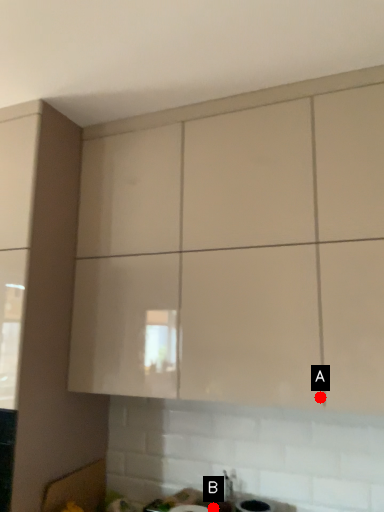
Question: Two points are circled on the image, labeled by A and B beside each circle. Which point is farther from the camera taking this photo?

Choices:
 (A) A is further
 (B) B is further

Answer: (B)